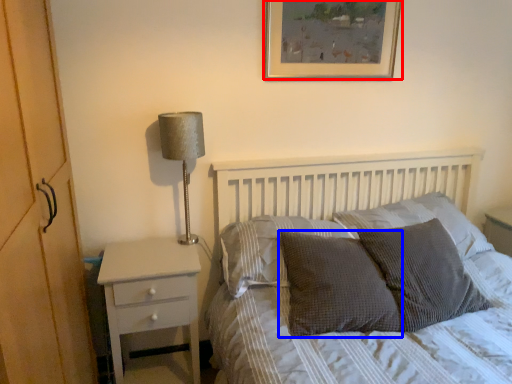
Question: Which point is further to the camera, picture frame (highlighted by a red box) or pillow (highlighted by a blue box)?

Choices:
 (A) picture frame
 (B) pillow

Answer: (A)